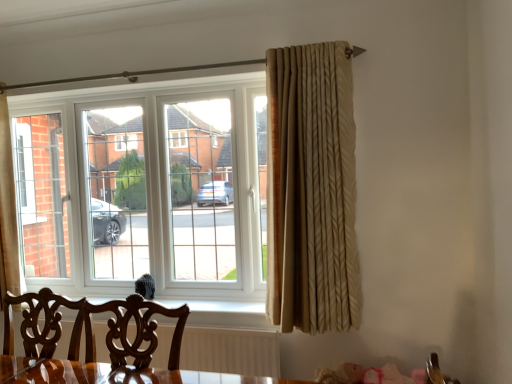
Locate an element on the screen. The image size is (512, 384). mahogany wood swivel chair at lower left is located at coordinates (44, 324).

Measure the distance between point (78, 312) and camera.

Point (78, 312) is 2.06 meters from camera.

In order to click on white plastic window at center in this screenshot , I will do `click(142, 188)`.

Describe the element at coordinates (92, 329) in the screenshot. I see `mahogany wood chair at lower center` at that location.

Identify the location of mahogany wood swivel chair at lower left. (44, 324).

Is the depth of beige textured curtain at right less than that of white plastic window at center?

Yes, it is in front of white plastic window at center.

Is white plastic window at center surrounded by beige textured curtain at right?

That's incorrect, white plastic window at center is not inside beige textured curtain at right.

Considering the points (316, 229) and (248, 209), which point is in front, point (316, 229) or point (248, 209)?

The point (316, 229) is in front.

Considering the points (112, 318) and (252, 137), which point is behind, point (112, 318) or point (252, 137)?

Positioned behind is point (252, 137).

Is white plastic window at center inside mahogany wood chair at lower center?

No, white plastic window at center is not inside mahogany wood chair at lower center.

I want to click on chair that appears on the right of white plastic window at center, so click(92, 329).

From the image's perspective, is mahogany wood chair at lower center below white plastic window at center?

Yes.

Are white plastic window at center and mahogany wood swivel chair at lower left making contact?

No, white plastic window at center is not making contact with mahogany wood swivel chair at lower left.

Considering their positions, is white plastic window at center located in front of or behind mahogany wood swivel chair at lower left?

white plastic window at center is behind mahogany wood swivel chair at lower left.

From the image's perspective, would you say white plastic window at center is positioned over mahogany wood swivel chair at lower left?

Correct, white plastic window at center appears higher than mahogany wood swivel chair at lower left in the image.

Does white plastic window at center appear on the right side of mahogany wood chair at lower center?

No.

Considering the relative sizes of white plastic window at center and mahogany wood chair at lower center in the image provided, is white plastic window at center taller than mahogany wood chair at lower center?

Correct, white plastic window at center is much taller as mahogany wood chair at lower center.

Would you say white plastic window at center is inside or outside mahogany wood chair at lower center?

white plastic window at center exists outside the volume of mahogany wood chair at lower center.

From a real-world perspective, which object stands above the other?

white plastic window at center, from a real-world perspective.

Can you confirm if mahogany wood chair at lower center is thinner than beige textured curtain at right?

In fact, mahogany wood chair at lower center might be wider than beige textured curtain at right.

Is there a large distance between mahogany wood chair at lower center and beige textured curtain at right?

No, there isn't a large distance between mahogany wood chair at lower center and beige textured curtain at right.

Identify the location of curtain above the mahogany wood chair at lower center (from the image's perspective). (312, 189).

In the scene shown: From the image's perspective, relative to mahogany wood chair at lower center, is mahogany wood swivel chair at lower left above or below?

From the image's perspective, mahogany wood swivel chair at lower left appears below mahogany wood chair at lower center.

From their relative heights in the image, would you say mahogany wood swivel chair at lower left is taller or shorter than mahogany wood chair at lower center?

Considering their sizes, mahogany wood swivel chair at lower left has more height than mahogany wood chair at lower center.

From a real-world perspective, which is physically above, mahogany wood swivel chair at lower left or mahogany wood chair at lower center?

mahogany wood chair at lower center.

Which point is more distant from viewer, [45,341] or [148,331]?

Positioned behind is point [45,341].

Does beige textured curtain at right touch mahogany wood chair at lower center?

No, beige textured curtain at right is not in contact with mahogany wood chair at lower center.

Considering the sizes of objects beige textured curtain at right and mahogany wood chair at lower center in the image provided, who is thinner, beige textured curtain at right or mahogany wood chair at lower center?

With smaller width is beige textured curtain at right.

From the image's perspective, is beige textured curtain at right positioned above or below mahogany wood chair at lower center?

beige textured curtain at right is situated higher than mahogany wood chair at lower center in the image.

The image size is (512, 384). What are the coordinates of `window behind the beige textured curtain at right` in the screenshot? It's located at (142, 188).

This screenshot has width=512, height=384. I want to click on window on the left of mahogany wood chair at lower center, so click(x=142, y=188).

Considering their positions, is beige textured curtain at right positioned further to mahogany wood swivel chair at lower left than white plastic window at center?

The object further to mahogany wood swivel chair at lower left is beige textured curtain at right.

Looking at the image, which one is located closer to mahogany wood swivel chair at lower left, mahogany wood chair at lower center or white plastic window at center?

mahogany wood chair at lower center is positioned closer to the anchor mahogany wood swivel chair at lower left.

Based on their spatial positions, is beige textured curtain at right or mahogany wood chair at lower center closer to mahogany wood swivel chair at lower left?

mahogany wood chair at lower center lies closer to mahogany wood swivel chair at lower left than the other object.

From the image, which object appears to be farther from beige textured curtain at right, mahogany wood chair at lower center or mahogany wood swivel chair at lower left?

mahogany wood swivel chair at lower left lies further to beige textured curtain at right than the other object.

Based on their spatial positions, is white plastic window at center or beige textured curtain at right closer to mahogany wood chair at lower center?

beige textured curtain at right is closer to mahogany wood chair at lower center.

Consider the image. Based on their spatial positions, is white plastic window at center or mahogany wood swivel chair at lower left closer to beige textured curtain at right?

Among the two, white plastic window at center is located nearer to beige textured curtain at right.

Based on their spatial positions, is mahogany wood swivel chair at lower left or beige textured curtain at right further from white plastic window at center?

mahogany wood swivel chair at lower left.

When comparing their distances from white plastic window at center, does mahogany wood swivel chair at lower left or mahogany wood chair at lower center seem closer?

mahogany wood chair at lower center is positioned closer to the anchor white plastic window at center.

You are a GUI agent. You are given a task and a screenshot of the screen. Output one action in this format:
    pyautogui.click(x=<x>, y=<y>)
    Task: Click on the chair located between mahogany wood swivel chair at lower left and beige textured curtain at right in the left-right direction
    This screenshot has width=512, height=384.
    Given the screenshot: What is the action you would take?
    pyautogui.click(x=92, y=329)

The image size is (512, 384). I want to click on swivel chair between mahogany wood chair at lower center and white plastic window at center in the front-back direction, so pyautogui.click(x=44, y=324).

Image resolution: width=512 pixels, height=384 pixels. What are the coordinates of `chair located between white plastic window at center and beige textured curtain at right in the left-right direction` in the screenshot? It's located at (92, 329).

Locate an element on the screen. The width and height of the screenshot is (512, 384). window between mahogany wood swivel chair at lower left and beige textured curtain at right in the horizontal direction is located at coordinates (142, 188).